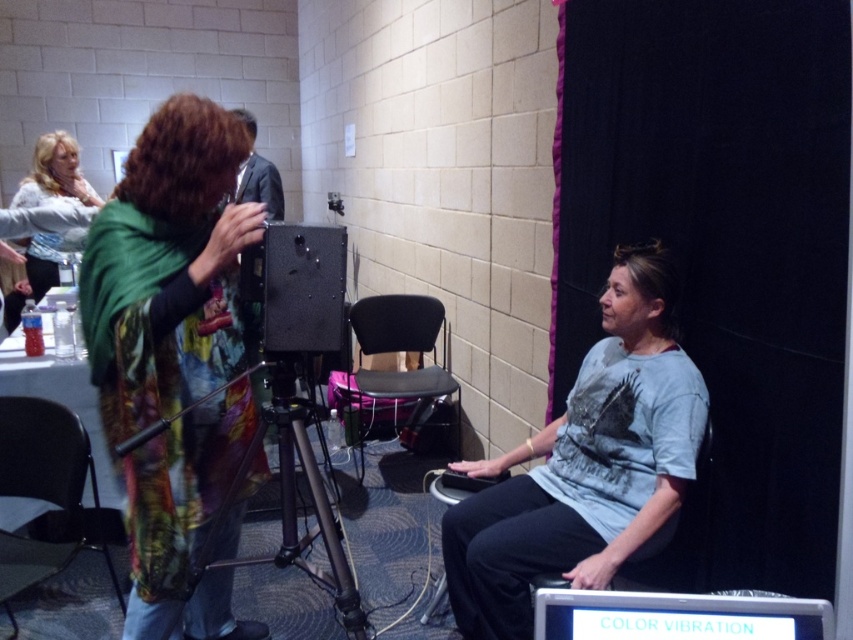
You are a GUI agent. You are given a task and a screenshot of the screen. Output one action in this format:
    pyautogui.click(x=<x>, y=<y>)
    Task: Click on the metallic gray chair at lower left
    The image size is (853, 640).
    Given the screenshot: What is the action you would take?
    pyautogui.click(x=44, y=492)

Can you confirm if metallic gray chair at lower left is positioned below metallic tripod at center?

Correct, metallic gray chair at lower left is located below metallic tripod at center.

Who is more distant from viewer, (70, 484) or (325, 572)?

Point (325, 572)

This screenshot has width=853, height=640. I want to click on metallic gray chair at lower left, so click(44, 492).

Looking at this image, is gray cotton shirt at center to the right of white plastic computer at lower center from the viewer's perspective?

Indeed, gray cotton shirt at center is positioned on the right side of white plastic computer at lower center.

Is point (628, 291) behind point (538, 609)?

Yes, point (628, 291) is farther from viewer.

I want to click on gray cotton shirt at center, so click(585, 465).

Does metallic gray chair at lower left have a lesser width compared to black fabric chair at center?

Correct, metallic gray chair at lower left's width is less than black fabric chair at center's.

Who is lower down, metallic gray chair at lower left or black fabric chair at center?

metallic gray chair at lower left is below.

Which is behind, point (68, 490) or point (415, 307)?

Positioned behind is point (415, 307).

Identify the location of metallic gray chair at lower left. The height and width of the screenshot is (640, 853). coord(44,492).